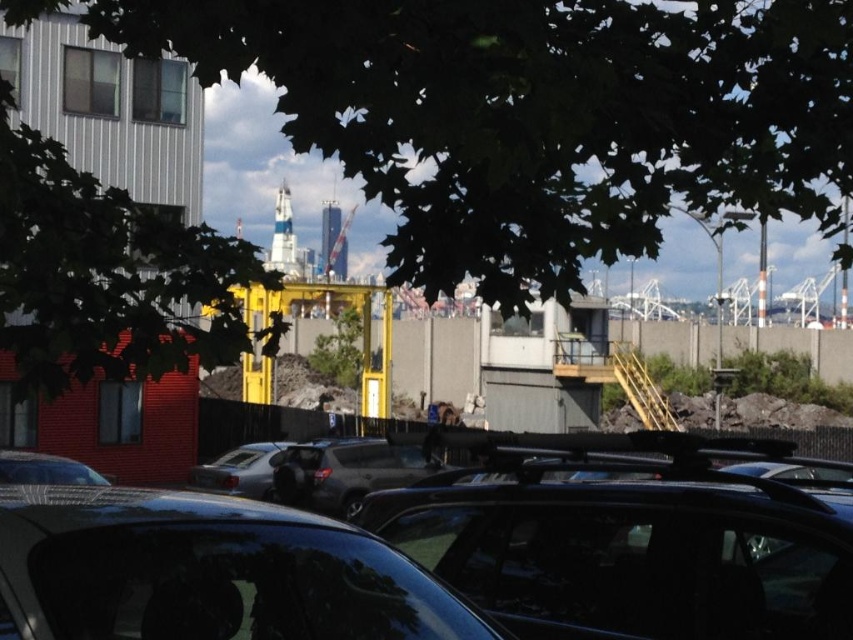
You are a delivery person with a 3 meter long ladder that needs to be transported horizontally. You are standing near the green leafy tree at upper left and the matte black car at lower left. Can you fit the ladder between these two objects without bending it?

The distance between the green leafy tree at upper left and the matte black car at lower left is 2.85 meters, so the 3 meter ladder cannot fit between them horizontally as it is longer than the available space.

You are a delivery driver who needs to park your satin silver car at center in the parking lot. However, there is a green leafy tree at upper left blocking part of the view. Can you still see the construction site with the yellow crane from your parked position?

The green leafy tree at upper left is above the satin silver car at center, so when parked, the tree might block some of the view, but since it is positioned above, you should still be able to see the construction site with the yellow crane below the tree.